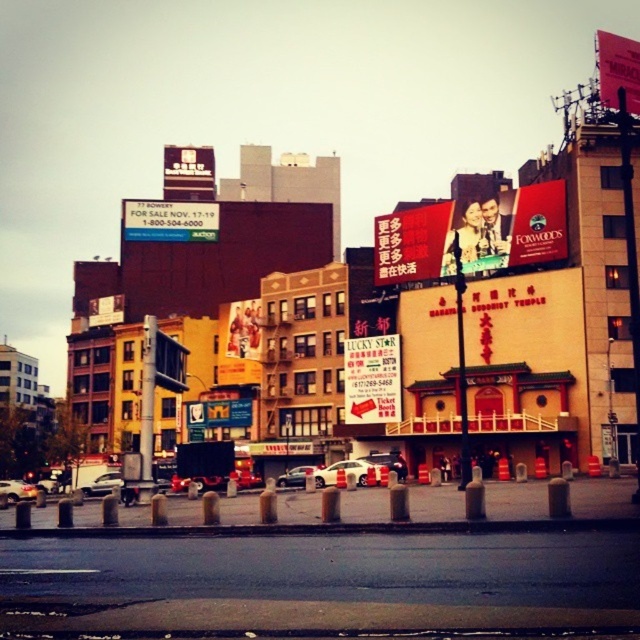
Question: Does red matte billboard at center have a greater width compared to matte red sign at upper right?

Choices:
 (A) yes
 (B) no

Answer: (A)

Question: Can you confirm if blue glossy sign at upper left is thinner than matte gold billboard at center?

Choices:
 (A) yes
 (B) no

Answer: (B)

Question: Which object is the closest to the matte blue sign at center?

Choices:
 (A) metallic silver car at lower left
 (B) silver metallic sedan at lower left

Answer: (B)

Question: Does matte plastic billboard at center have a lesser width compared to red matte billboard at upper right?

Choices:
 (A) no
 (B) yes

Answer: (B)

Question: Which of the following is the farthest from the observer?

Choices:
 (A) (218, 403)
 (B) (291, 481)
 (C) (3, 490)

Answer: (A)

Question: Which object is closer to the camera taking this photo?

Choices:
 (A) matte blue sign at center
 (B) metallic sign at upper center
 (C) red matte billboard at center

Answer: (C)